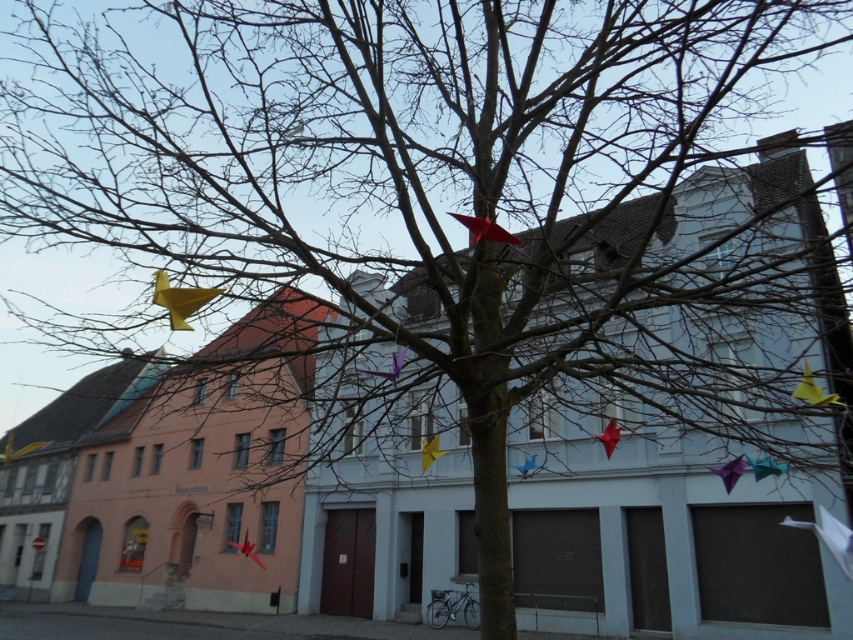
Which is in front, point (759, 461) or point (612, 444)?

Point (612, 444) is in front.

Who is more distant from viewer, (779,467) or (612,433)?

Point (779,467)

Does point (780, 470) come farther from viewer compared to point (610, 422)?

That is True.

Find the location of a particular element. The image size is (853, 640). teal fabric flag at center right is located at coordinates pos(764,467).

Which is more to the right, red paper flag at upper center or red paper flag at lower center?

red paper flag at upper center

Does point (485, 218) come farther from viewer compared to point (253, 547)?

That is False.

Is point (474, 230) positioned behind point (259, 564)?

No.

The height and width of the screenshot is (640, 853). Identify the location of red paper flag at upper center. (485, 228).

Is yellow paper flag at right above purple paper flag at center?

Indeed, yellow paper flag at right is positioned over purple paper flag at center.

You are a GUI agent. You are given a task and a screenshot of the screen. Output one action in this format:
    pyautogui.click(x=<x>, y=<y>)
    Task: Click on the yellow paper flag at right
    
    Given the screenshot: What is the action you would take?
    pyautogui.click(x=813, y=390)